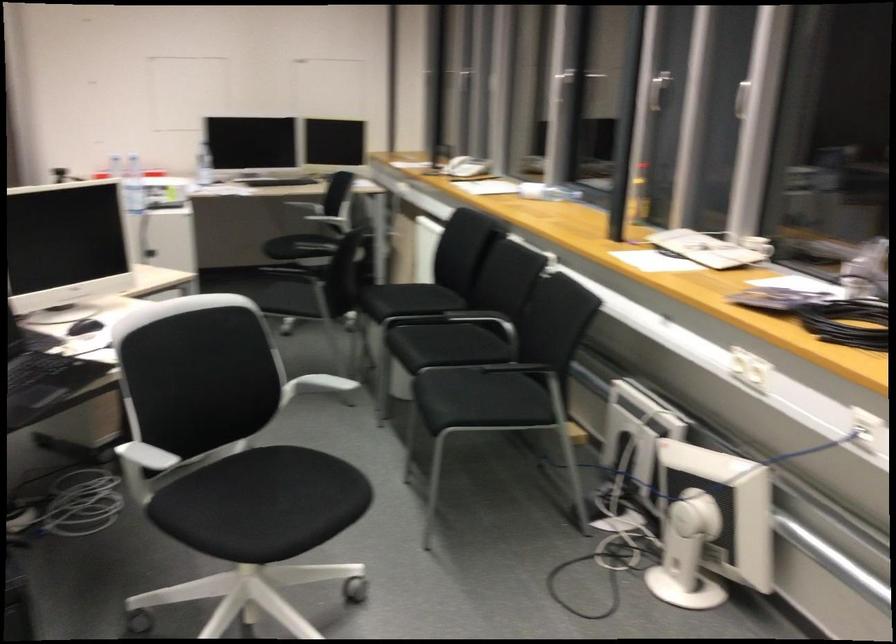
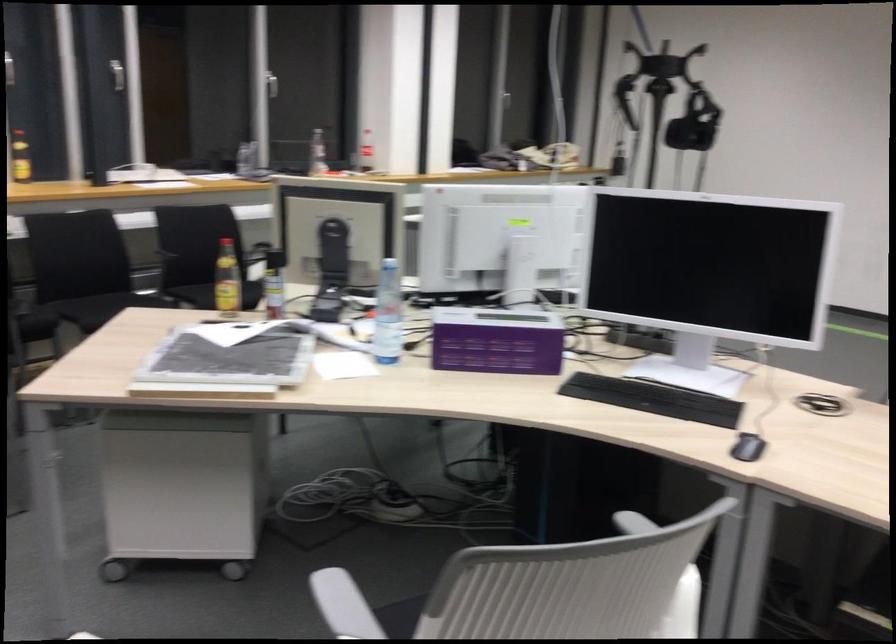
Locate, in the second image, the point that corresponds to point (464, 377) in the first image.

(192, 295)